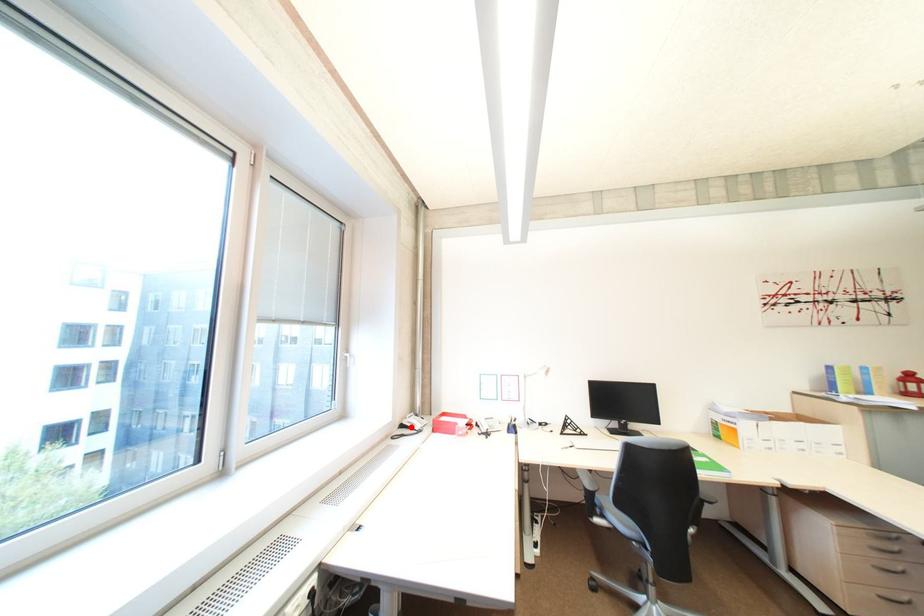
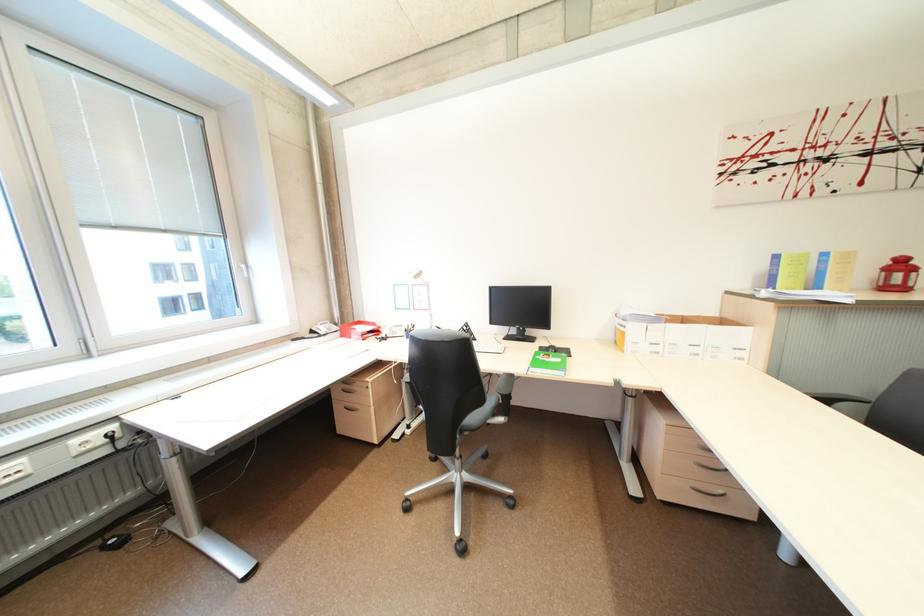
In the second image, find the point that corresponds to the highlighted location in the first image.

(321, 333)